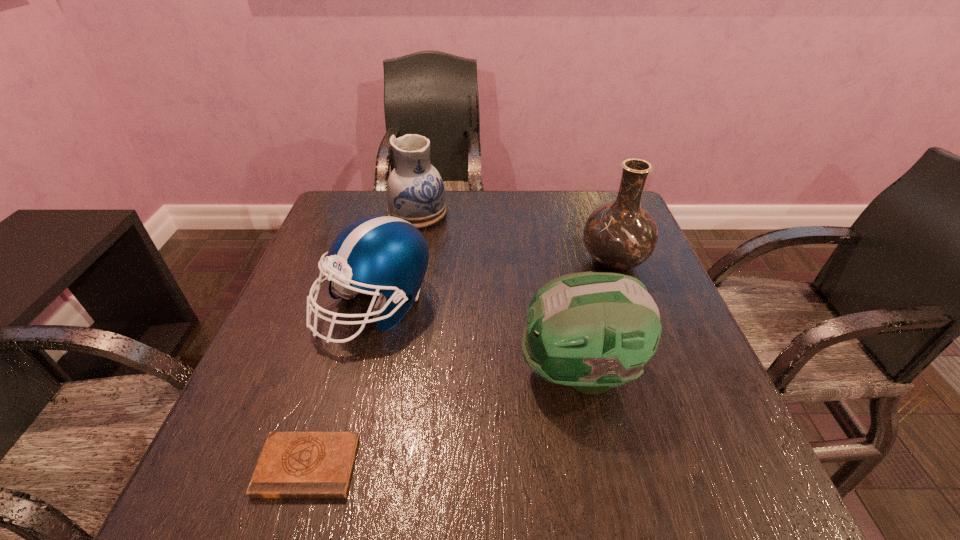
Find the location of a particular element. The height and width of the screenshot is (540, 960). vacant space at the near edge of the desktop is located at coordinates pos(451,496).

Where is `vacant space at the left edge of the desktop`? vacant space at the left edge of the desktop is located at coordinates (348, 307).

This screenshot has height=540, width=960. In the image, there is a desktop. Find the location of `vacant space at the right edge`. vacant space at the right edge is located at coordinates (636, 389).

This screenshot has height=540, width=960. Identify the location of free space at the far left corner of the desktop. (370, 200).

Identify the location of vacant space at the far right corner. The image size is (960, 540). (590, 193).

Where is `empty space that is in between the right football helmet and the shortest object`? This screenshot has width=960, height=540. empty space that is in between the right football helmet and the shortest object is located at coordinates (444, 419).

Find the location of a particular element. The width and height of the screenshot is (960, 540). vacant space in between the nearest object and the right football helmet is located at coordinates (444, 419).

Locate an element on the screen. The height and width of the screenshot is (540, 960). free space between the diary and the tallest object is located at coordinates (461, 364).

Image resolution: width=960 pixels, height=540 pixels. I want to click on vacant space that is in between the farthest object and the tallest object, so (516, 238).

Find the location of a particular element. vacant area that lies between the shortest object and the farthest object is located at coordinates (362, 339).